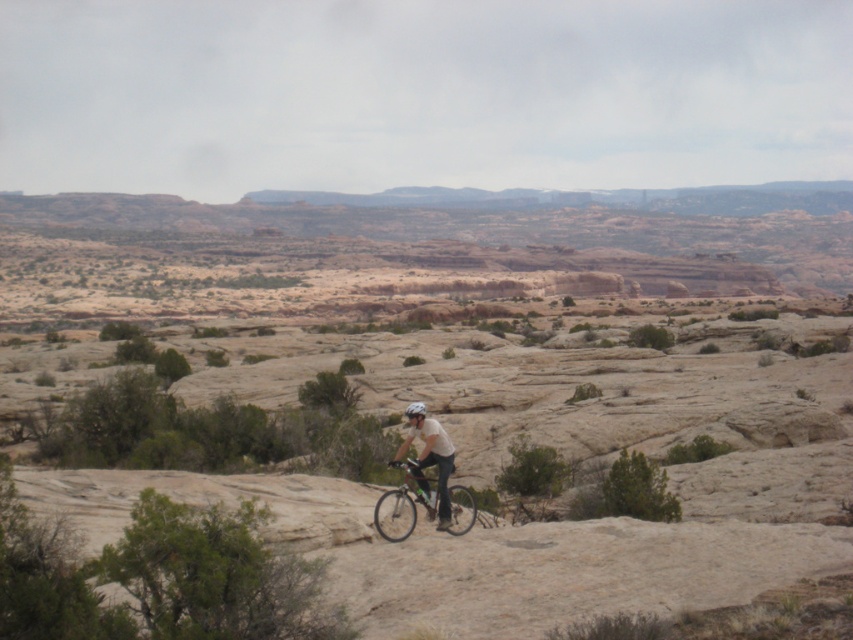
Between point (462, 472) and point (422, 404), which one is positioned in front?

Point (422, 404) is more forward.

Is desert sandstone terrain at center below shiny silver helmet at center?

No.

This screenshot has height=640, width=853. I want to click on desert sandstone terrain at center, so click(x=436, y=394).

At what (x,y) coordinates should I click in order to perform the action: click on desert sandstone terrain at center. Please return your answer as a coordinate pair (x, y). The image size is (853, 640). Looking at the image, I should click on (436, 394).

Which of these two, desert sandstone terrain at center or white matte helmet at center, stands taller?

desert sandstone terrain at center is taller.

Image resolution: width=853 pixels, height=640 pixels. What do you see at coordinates (436, 394) in the screenshot?
I see `desert sandstone terrain at center` at bounding box center [436, 394].

Who is more distant from viewer, (97, 396) or (444, 460)?

The point (97, 396) is more distant.

The image size is (853, 640). Identify the location of desert sandstone terrain at center. (436, 394).

Is metallic silver bicycle at center wider than white matte helmet at center?

Yes.

Between point (434, 504) and point (409, 410), which one is positioned behind?

Positioned behind is point (409, 410).

The width and height of the screenshot is (853, 640). I want to click on metallic silver bicycle at center, so click(404, 509).